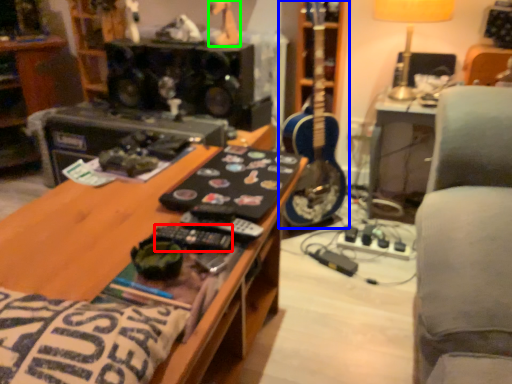
Question: Estimate the real-world distances between objects in this image. Which object is farther from control (highlighted by a red box), guitar (highlighted by a blue box) or toy (highlighted by a green box)?

Choices:
 (A) guitar
 (B) toy

Answer: (B)